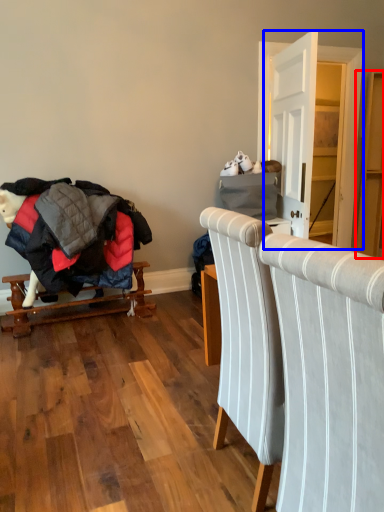
Question: Which point is closer to the camera, dresser (highlighted by a red box) or dresser (highlighted by a blue box)?

Choices:
 (A) dresser
 (B) dresser

Answer: (B)